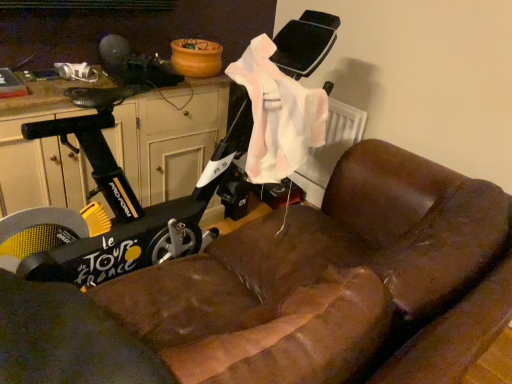
Question: From the image's perspective, is brown leather couch at lower right over wooden dresser at left?

Choices:
 (A) no
 (B) yes

Answer: (A)

Question: Is brown leather couch at lower right oriented away from wooden dresser at left?

Choices:
 (A) no
 (B) yes

Answer: (A)

Question: Considering the relative sizes of brown leather couch at lower right and wooden dresser at left in the image provided, is brown leather couch at lower right taller than wooden dresser at left?

Choices:
 (A) no
 (B) yes

Answer: (B)

Question: Can you confirm if brown leather couch at lower right is bigger than wooden dresser at left?

Choices:
 (A) yes
 (B) no

Answer: (A)

Question: Could you tell me if brown leather couch at lower right is turned towards wooden dresser at left?

Choices:
 (A) no
 (B) yes

Answer: (B)

Question: Is brown leather couch at lower right located outside wooden dresser at left?

Choices:
 (A) yes
 (B) no

Answer: (A)

Question: Is wooden dresser at left further to camera compared to brown leather couch at lower right?

Choices:
 (A) no
 (B) yes

Answer: (B)

Question: Does wooden dresser at left touch brown leather couch at lower right?

Choices:
 (A) yes
 (B) no

Answer: (B)

Question: Considering the relative sizes of wooden dresser at left and brown leather couch at lower right in the image provided, is wooden dresser at left smaller than brown leather couch at lower right?

Choices:
 (A) no
 (B) yes

Answer: (B)

Question: Does wooden dresser at left have a lesser height compared to brown leather couch at lower right?

Choices:
 (A) no
 (B) yes

Answer: (B)

Question: From a real-world perspective, is wooden dresser at left positioned under brown leather couch at lower right based on gravity?

Choices:
 (A) yes
 (B) no

Answer: (B)

Question: Is wooden dresser at left positioned far away from brown leather couch at lower right?

Choices:
 (A) yes
 (B) no

Answer: (B)

Question: Considering the positions of brown leather couch at lower right and wooden dresser at left in the image, is brown leather couch at lower right bigger or smaller than wooden dresser at left?

Choices:
 (A) small
 (B) big

Answer: (B)